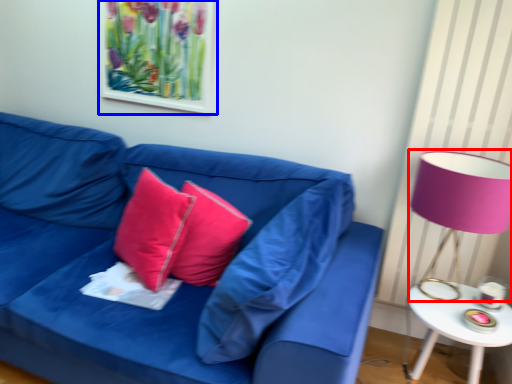
Question: Which point is further to the camera, table lamp (highlighted by a red box) or picture frame (highlighted by a blue box)?

Choices:
 (A) table lamp
 (B) picture frame

Answer: (B)